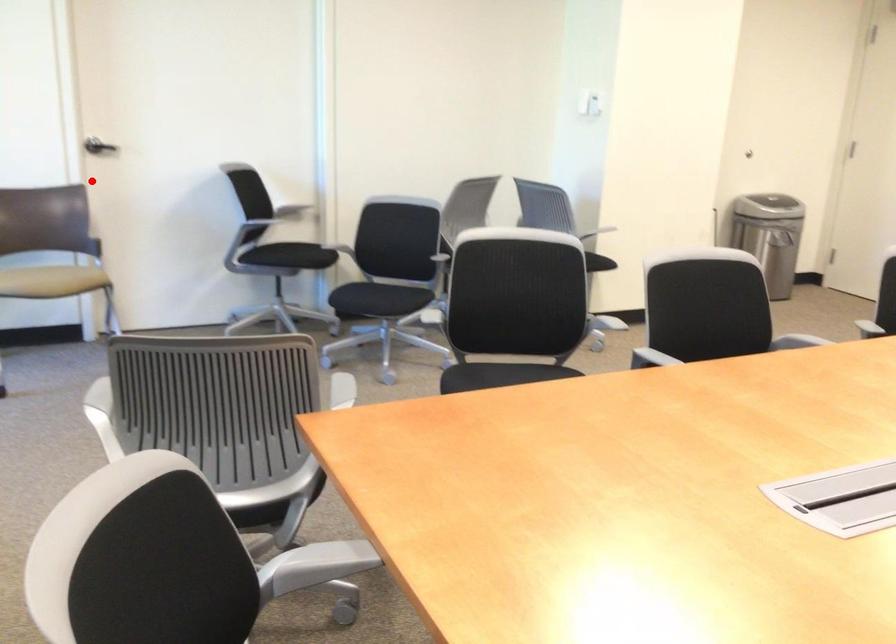
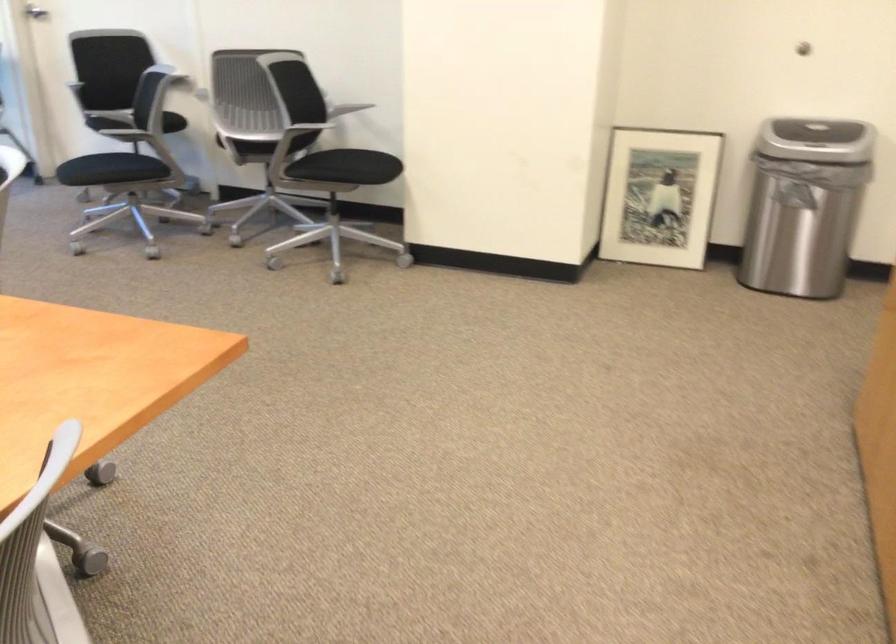
Question: I am providing you with two images of the same scene from different viewpoints. Image1 has a red point marked. In image2, the corresponding 3D location appears at what relative position? Reply with the corresponding letter.

Choices:
 (A) Closer
 (B) Farther

Answer: (B)